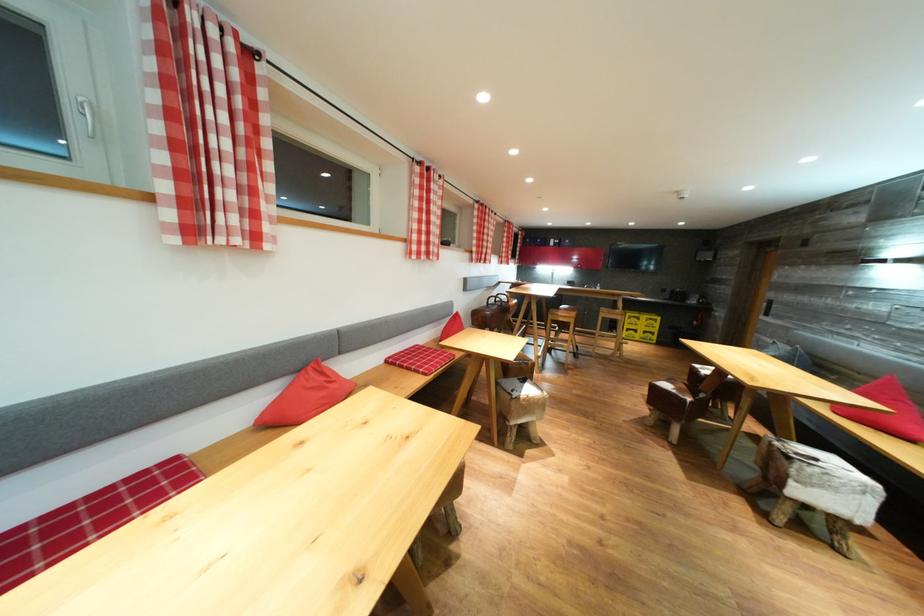
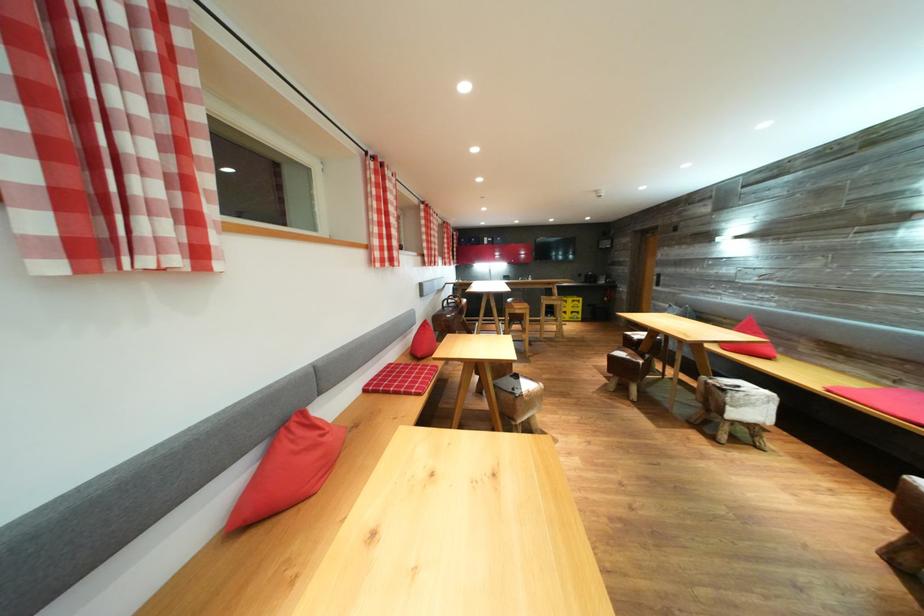
Question: Based on the continuous images, in which direction is the camera rotating? Reply with the corresponding letter.

Choices:
 (A) Left
 (B) Right
 (C) Up
 (D) Down

Answer: (B)